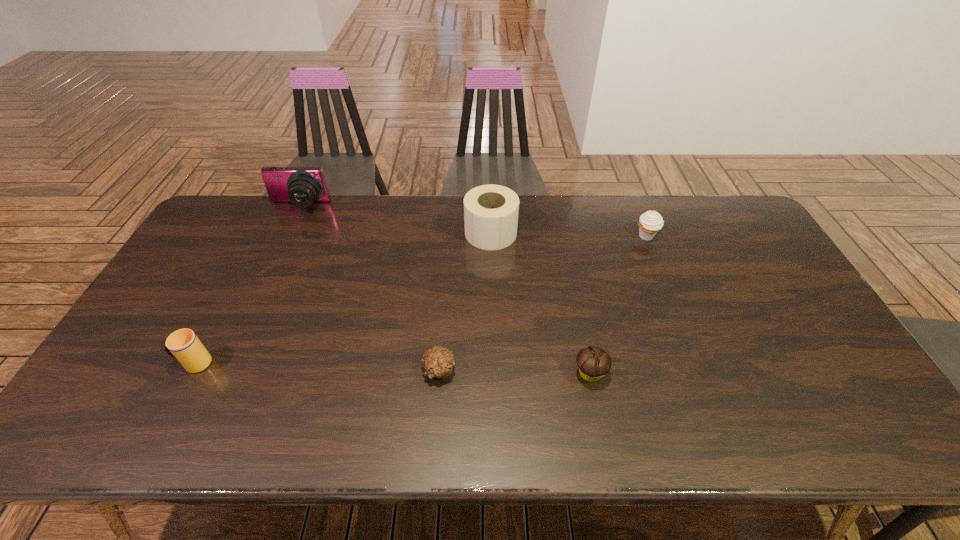
Where is `vacant space that satisfies the following two spatial constraints: 1. on the front-facing side of the farthest object; 2. on the right side of the farthest muffin`? The image size is (960, 540). vacant space that satisfies the following two spatial constraints: 1. on the front-facing side of the farthest object; 2. on the right side of the farthest muffin is located at coordinates (285, 236).

The image size is (960, 540). Identify the location of vacant space that satisfies the following two spatial constraints: 1. on the front-facing side of the third object from right to left; 2. on the left side of the farthest object. (286, 233).